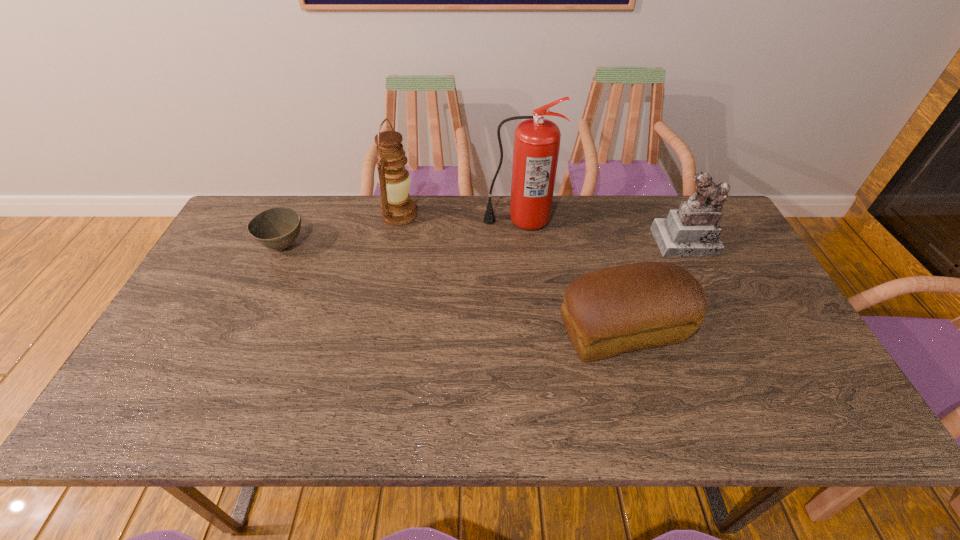
This screenshot has width=960, height=540. Identify the location of vacant area situated on the right of the fourth shortest object. (493, 215).

Locate an element on the screen. This screenshot has height=540, width=960. vacant space located 0.400m on the front-facing side of the figurine is located at coordinates pos(751,376).

In order to click on vacant space located on the front of the nearest object in this screenshot , I will do `click(649, 430)`.

The width and height of the screenshot is (960, 540). In order to click on vacant space located on the front of the shortest object in this screenshot , I will do `click(235, 353)`.

The height and width of the screenshot is (540, 960). In order to click on fire extinguisher positioned at the far edge in this screenshot , I will do `click(537, 140)`.

Find the location of a particular element. Image resolution: width=960 pixels, height=540 pixels. oil lamp at the far edge is located at coordinates (394, 180).

Identify the location of figurine at the far edge. The image size is (960, 540). tap(691, 231).

Identify the location of bowl that is at the far edge. The width and height of the screenshot is (960, 540). (276, 228).

Locate an element on the screen. object at the left edge is located at coordinates (276, 228).

Find the location of a particular element. object located in the right edge section of the desktop is located at coordinates (691, 231).